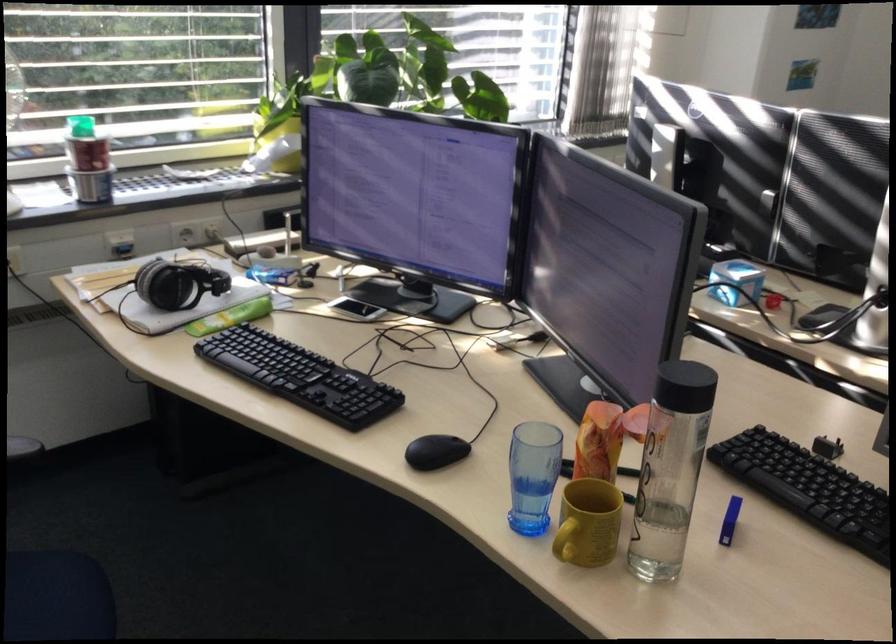
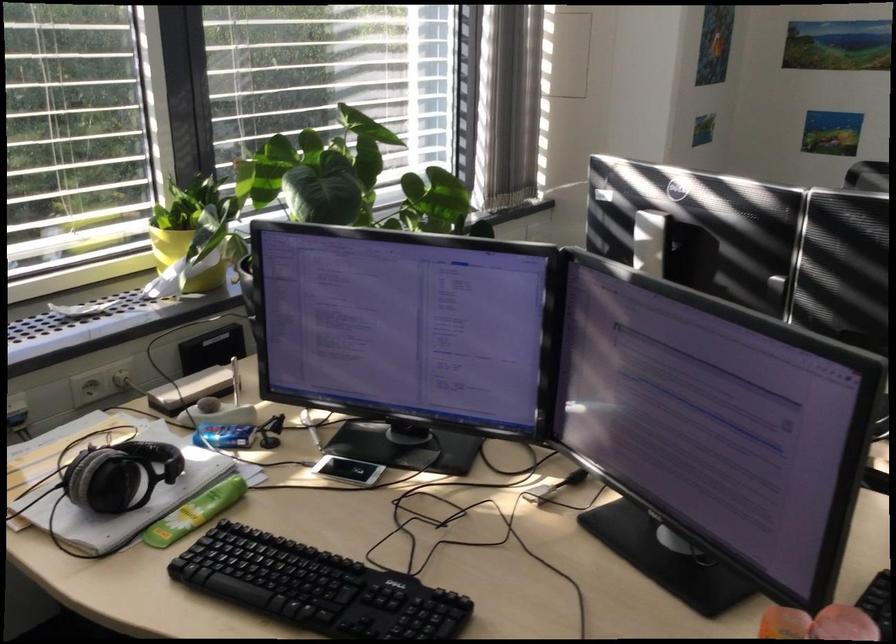
Question: How did the camera likely rotate?

Choices:
 (A) Left
 (B) Right
 (C) Up
 (D) Down

Answer: (B)